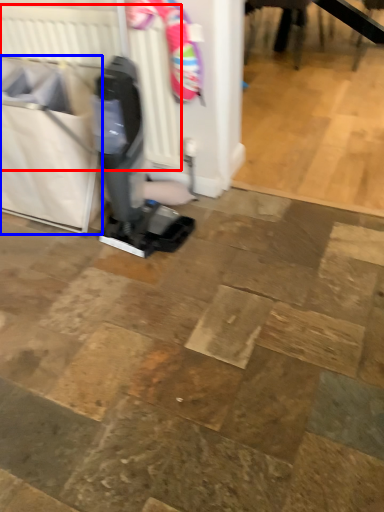
Question: Among these objects, which one is nearest to the camera, radiator (highlighted by a red box) or laundry basket (highlighted by a blue box)?

Choices:
 (A) radiator
 (B) laundry basket

Answer: (B)